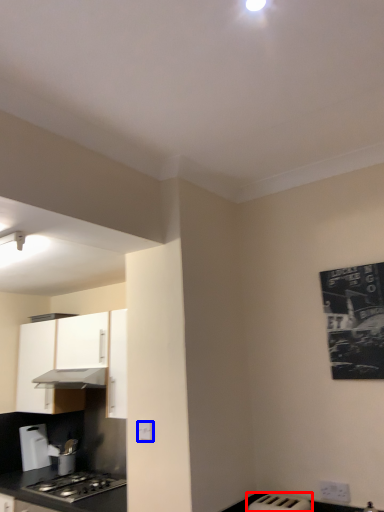
Question: Which of the following is the closest to the observer, appliance (highlighted by a red box) or electric outlet (highlighted by a blue box)?

Choices:
 (A) appliance
 (B) electric outlet

Answer: (A)